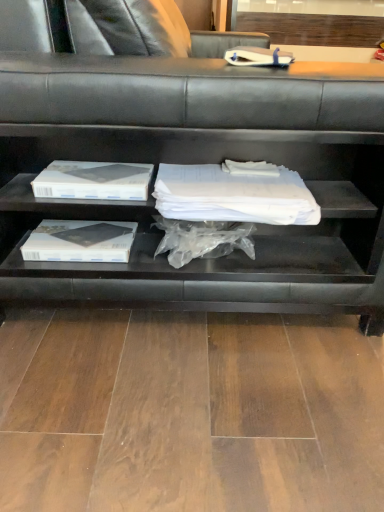
This screenshot has height=512, width=384. Describe the element at coordinates (258, 57) in the screenshot. I see `white paper at upper center` at that location.

Find the location of a particular element. This screenshot has height=512, width=384. white paper at upper center is located at coordinates (258, 57).

Describe the element at coordinates (196, 163) in the screenshot. The image size is (384, 512). I see `black matte shelf at center` at that location.

Where is `black matte shelf at center`? black matte shelf at center is located at coordinates (196, 163).

This screenshot has width=384, height=512. What are the coordinates of `white paper at upper center` in the screenshot? It's located at (258, 57).

Considering the relative positions of white paper at upper center and black matte shelf at center in the image provided, is white paper at upper center to the right of black matte shelf at center from the viewer's perspective?

Yes.

Is white paper at upper center closer to the viewer compared to black matte shelf at center?

No, white paper at upper center is further to the viewer.

Considering the points (252, 58) and (179, 91), which point is in front, point (252, 58) or point (179, 91)?

The point (179, 91) is in front.

From the image's perspective, is white paper at upper center beneath black matte shelf at center?

Yes, from the image's perspective, white paper at upper center is beneath black matte shelf at center.

From a real-world perspective, does white paper at upper center sit lower than black matte shelf at center?

Incorrect, from a real-world perspective, white paper at upper center is higher than black matte shelf at center.

Looking at their sizes, would you say white paper at upper center is wider or thinner than black matte shelf at center?

Clearly, white paper at upper center has less width compared to black matte shelf at center.

From the picture: Considering the sizes of objects white paper at upper center and black matte shelf at center in the image provided, who is shorter, white paper at upper center or black matte shelf at center?

white paper at upper center.

Considering the relative sizes of white paper at upper center and black matte shelf at center in the image provided, is white paper at upper center smaller than black matte shelf at center?

Yes, white paper at upper center is smaller than black matte shelf at center.

Is white paper at upper center not within black matte shelf at center?

That's incorrect, white paper at upper center is not completely outside black matte shelf at center.

Is white paper at upper center not near black matte shelf at center?

That's right, there is a large distance between white paper at upper center and black matte shelf at center.

Is white paper at upper center oriented towards black matte shelf at center?

Yes, white paper at upper center is facing black matte shelf at center.

How many degrees apart are the facing directions of white paper at upper center and black matte shelf at center?

The facing directions of white paper at upper center and black matte shelf at center are 10.8 degrees apart.

This screenshot has width=384, height=512. I want to click on book on the right side of black matte shelf at center, so click(258, 57).

Does black matte shelf at center appear on the left side of white paper at upper center?

Yes, black matte shelf at center is to the left of white paper at upper center.

Based on the photo, considering the positions of objects black matte shelf at center and white paper at upper center in the image provided, who is behind, black matte shelf at center or white paper at upper center?

white paper at upper center.

Is point (237, 269) closer to viewer compared to point (252, 63)?

Yes, it is.

From the image's perspective, would you say black matte shelf at center is positioned over white paper at upper center?

Indeed, from the image's perspective, black matte shelf at center is shown above white paper at upper center.

From a real-world perspective, who is located higher, black matte shelf at center or white paper at upper center?

white paper at upper center.

Considering the sizes of objects black matte shelf at center and white paper at upper center in the image provided, who is thinner, black matte shelf at center or white paper at upper center?

Thinner between the two is white paper at upper center.

Can you confirm if black matte shelf at center is taller than white paper at upper center?

Indeed, black matte shelf at center has a greater height compared to white paper at upper center.

Based on their sizes in the image, would you say black matte shelf at center is bigger or smaller than white paper at upper center?

In the image, black matte shelf at center appears to be larger than white paper at upper center.

Which is correct: black matte shelf at center is inside white paper at upper center, or outside of it?

black matte shelf at center lies outside white paper at upper center.

Would you consider black matte shelf at center to be distant from white paper at upper center?

Yes, black matte shelf at center and white paper at upper center are located far from each other.

Does black matte shelf at center turn towards white paper at upper center?

No, black matte shelf at center is not oriented towards white paper at upper center.

What's the angular difference between black matte shelf at center and white paper at upper center's facing directions?

The angular difference between black matte shelf at center and white paper at upper center is 10.8 degrees.

Measure the distance from black matte shelf at center to white paper at upper center.

They are 4.70 feet apart.

The height and width of the screenshot is (512, 384). Find the location of `book that is above the black matte shelf at center (from a real-world perspective)`. book that is above the black matte shelf at center (from a real-world perspective) is located at coordinates [x=258, y=57].

Image resolution: width=384 pixels, height=512 pixels. In the image, there is a black matte shelf at center. What are the coordinates of `book below it (from the image's perspective)` in the screenshot? It's located at (258, 57).

Identify the location of shelf located above the white paper at upper center (from the image's perspective). The height and width of the screenshot is (512, 384). (196, 163).